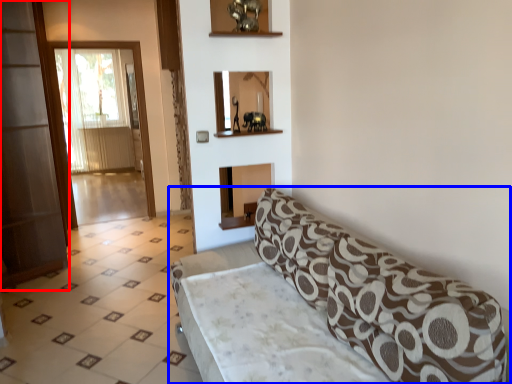
Question: Which object appears farthest to the camera in this image, screen door (highlighted by a red box) or studio couch (highlighted by a blue box)?

Choices:
 (A) screen door
 (B) studio couch

Answer: (A)